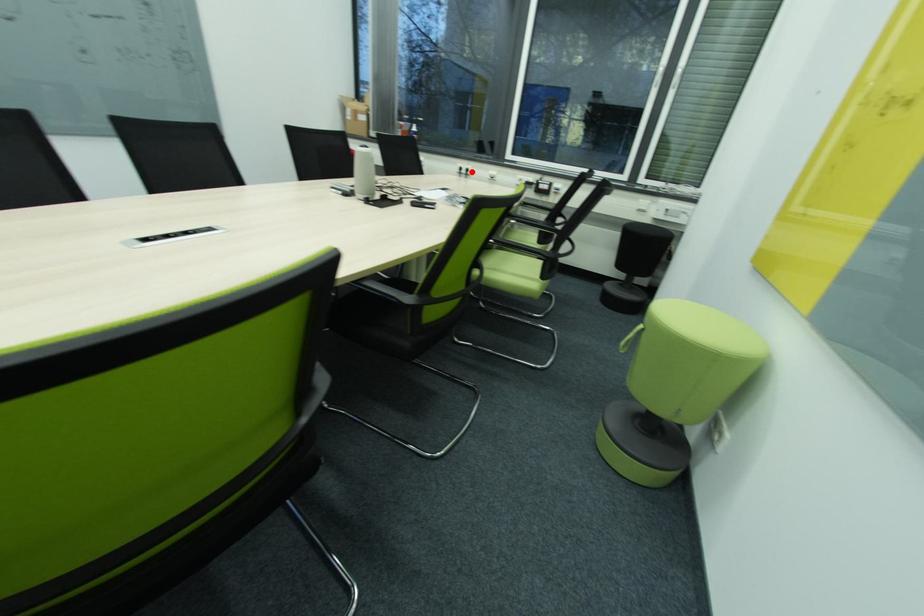
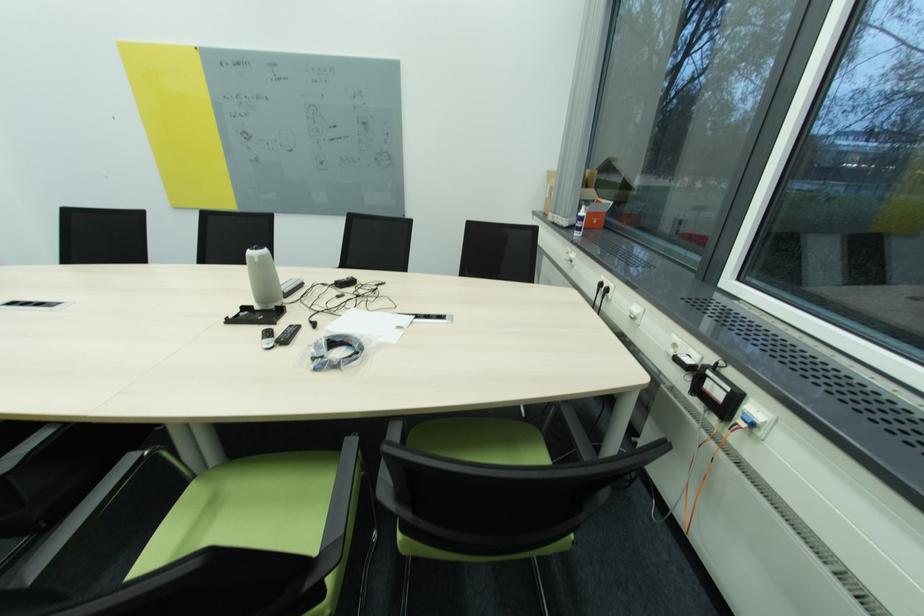
The point at the highlighted location is marked in the first image. Where is the corresponding point in the second image?

(612, 291)